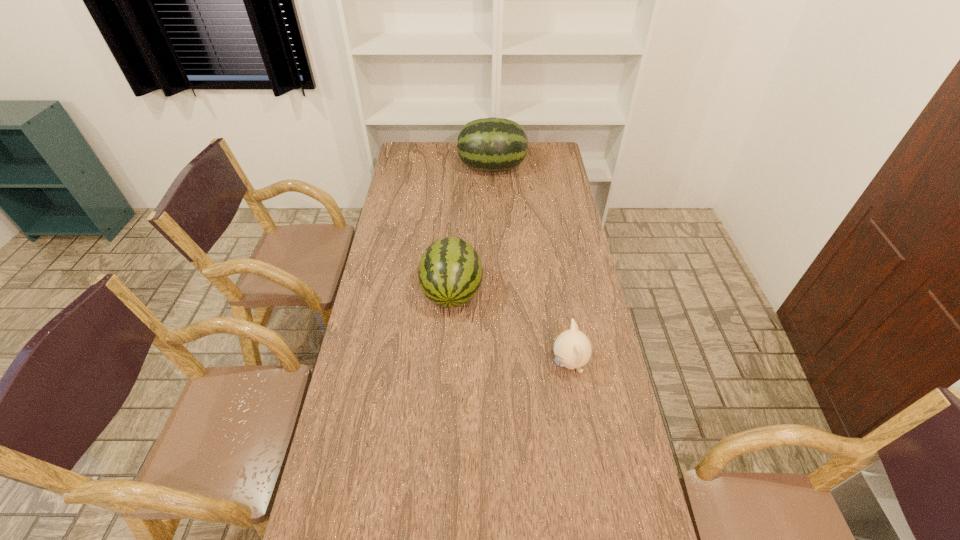
At what (x,y) coordinates should I click in order to perform the action: click on the farthest object. Please return your answer as a coordinate pair (x, y). The image size is (960, 540). Looking at the image, I should click on tap(491, 144).

Locate an element on the screen. The image size is (960, 540). the nearer watermelon is located at coordinates (450, 271).

Where is `the second tallest object`? the second tallest object is located at coordinates (450, 271).

This screenshot has height=540, width=960. Identify the location of kitten. (572, 348).

You are a GUI agent. You are given a task and a screenshot of the screen. Output one action in this format:
    pyautogui.click(x=<x>, y=<y>)
    Task: Click on the nearest object
    This screenshot has width=960, height=540.
    Given the screenshot: What is the action you would take?
    pyautogui.click(x=572, y=348)

You are a GUI agent. You are given a task and a screenshot of the screen. Output one action in this format:
    pyautogui.click(x=<x>, y=<y>)
    Task: Click on the vacant region located 0.270m on the front of the farthest object
    This screenshot has width=960, height=540.
    Given the screenshot: What is the action you would take?
    pyautogui.click(x=493, y=218)

Identify the location of vacant space located 0.150m at the stem end of the nearer watermelon. This screenshot has width=960, height=540. (448, 358).

Where is `vacant space located on the face of the shortest object`? The width and height of the screenshot is (960, 540). vacant space located on the face of the shortest object is located at coordinates (501, 363).

You are a GUI agent. You are given a task and a screenshot of the screen. Output one action in this format:
    pyautogui.click(x=<x>, y=<y>)
    Task: Click on the vacant space situated 0.370m on the face of the shortest object
    This screenshot has height=540, width=960.
    Given the screenshot: What is the action you would take?
    pyautogui.click(x=436, y=363)

In order to click on vacant region located 0.200m on the face of the shortest object in this screenshot , I will do `click(489, 363)`.